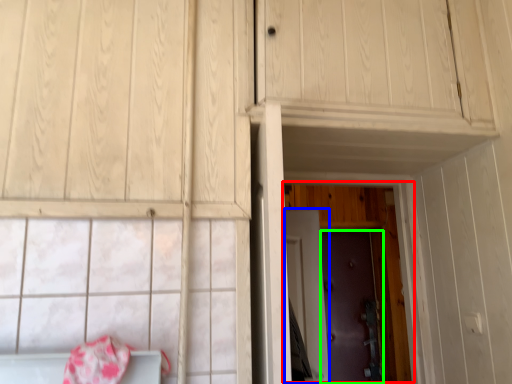
Question: Estimate the real-world distances between objects in this image. Which object is closer to door (highlighted by a red box), door (highlighted by a blue box) or door (highlighted by a green box)?

Choices:
 (A) door
 (B) door

Answer: (B)